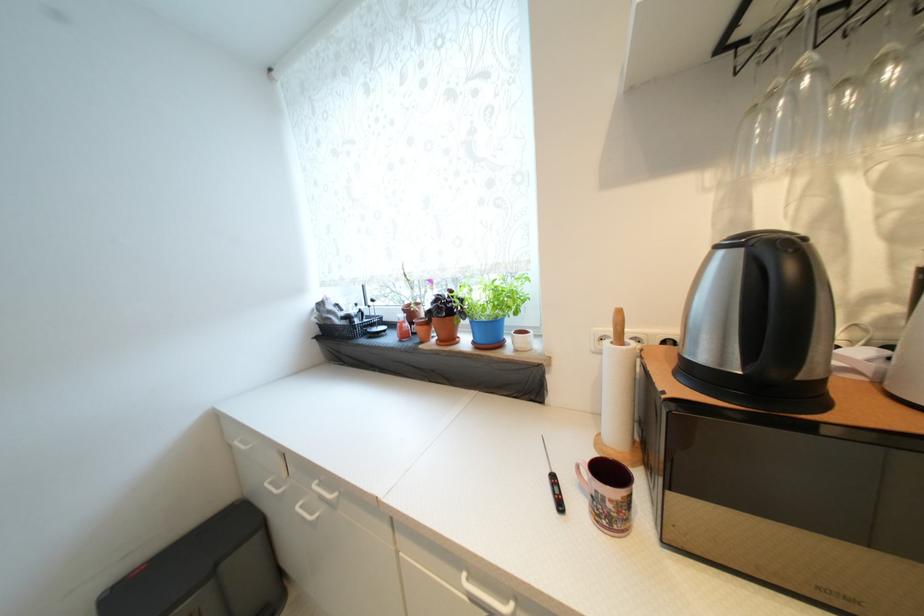
Find the location of a particular element. blue plant pot is located at coordinates (492, 305).